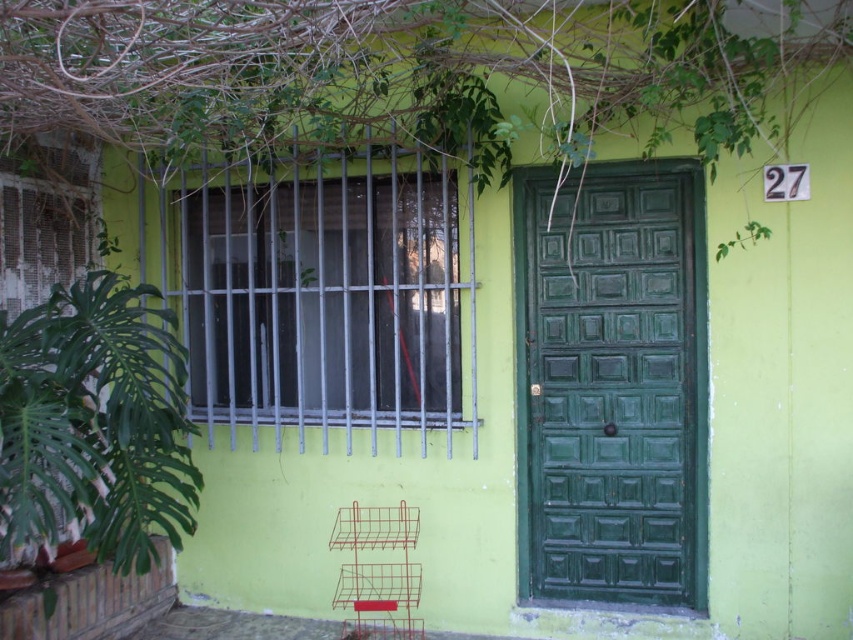
Between green leafy plant at upper center and green leafy plant at left, which one appears on the right side from the viewer's perspective?

green leafy plant at upper center is more to the right.

Is point (161, 26) in front of point (67, 333)?

Yes, it is.

Measure the distance between point (282, 29) and camera.

Point (282, 29) is 3.04 meters from camera.

Image resolution: width=853 pixels, height=640 pixels. Find the location of `green leafy plant at upper center`. green leafy plant at upper center is located at coordinates (410, 74).

The width and height of the screenshot is (853, 640). Describe the element at coordinates (328, 294) in the screenshot. I see `metallic bars at center` at that location.

Which of these two, metallic bars at center or green leafy plant at left, stands shorter?

With less height is green leafy plant at left.

At what (x,y) coordinates should I click in order to perform the action: click on metallic bars at center. Please return your answer as a coordinate pair (x, y). Image resolution: width=853 pixels, height=640 pixels. Looking at the image, I should click on (328, 294).

Can you confirm if green leafy plant at upper center is bigger than green wooden door at center?

Correct, green leafy plant at upper center is larger in size than green wooden door at center.

Is green leafy plant at upper center taller than green wooden door at center?

In fact, green leafy plant at upper center may be shorter than green wooden door at center.

This screenshot has height=640, width=853. In order to click on green leafy plant at upper center in this screenshot , I will do pos(410,74).